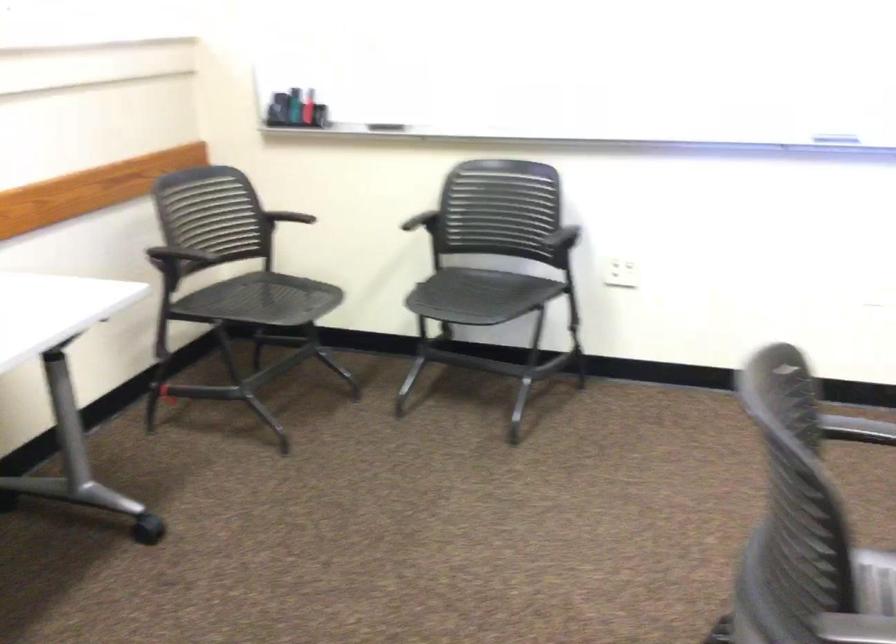
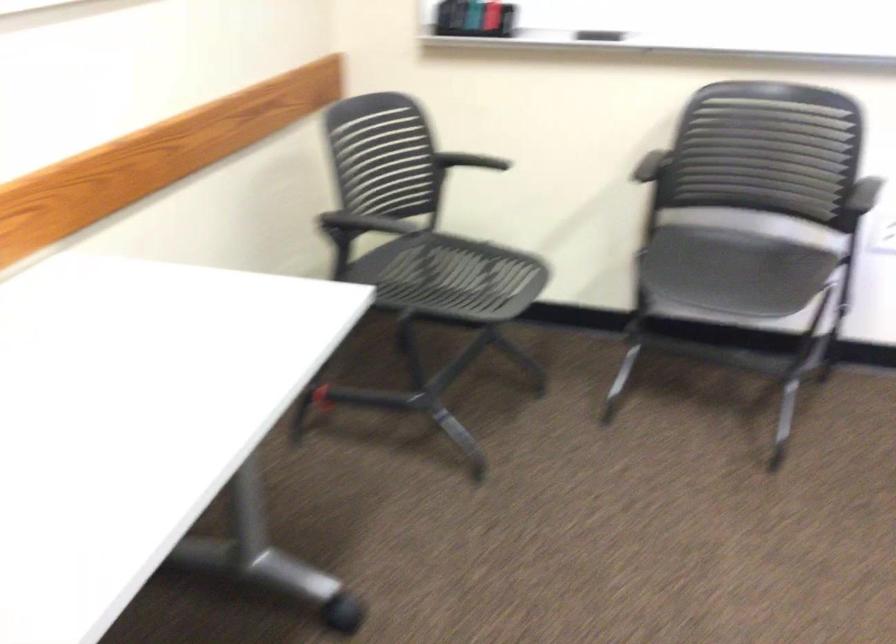
Question: The images are taken continuously from a first-person perspective. In which direction is your viewpoint rotating?

Choices:
 (A) Left
 (B) Right
 (C) Up
 (D) Down

Answer: (D)